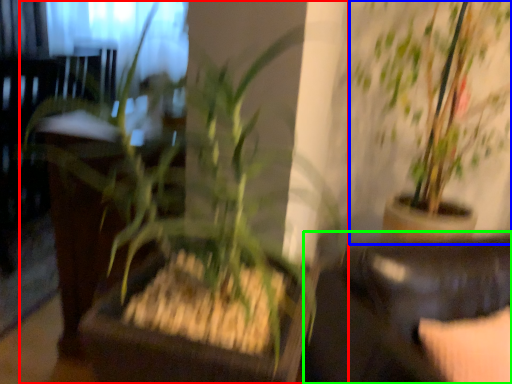
Question: Considering the real-world distances, which object is closest to houseplant (highlighted by a red box)? houseplant (highlighted by a blue box) or rocking chair (highlighted by a green box).

Choices:
 (A) houseplant
 (B) rocking chair

Answer: (B)